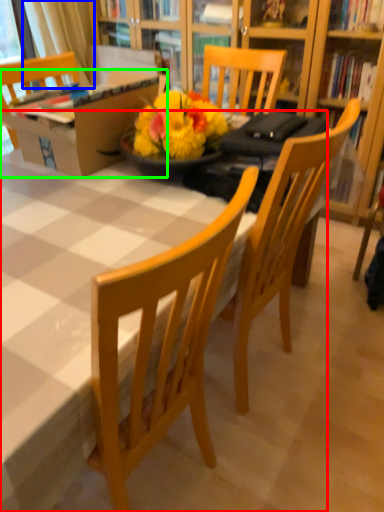
Question: Which object is positioned farthest from desk (highlighted by a red box)? Select from curtain (highlighted by a blue box) and box (highlighted by a green box).

Choices:
 (A) curtain
 (B) box

Answer: (A)